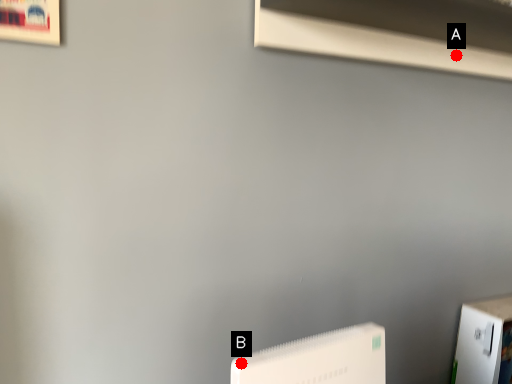
Question: Two points are circled on the image, labeled by A and B beside each circle. Which point is closer to the camera?

Choices:
 (A) A is closer
 (B) B is closer

Answer: (B)